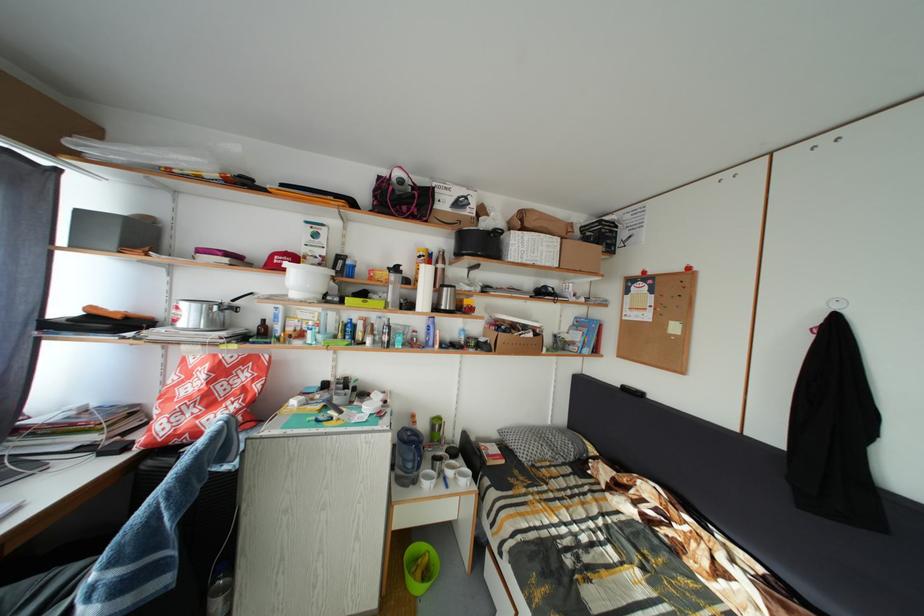
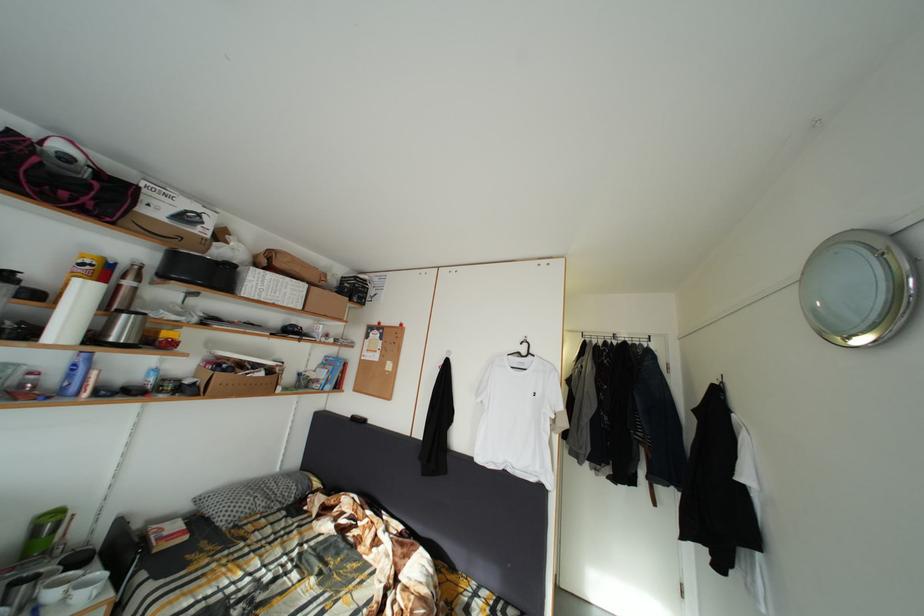
Where in the second image is the point corresponding to [429,262] from the first image?

(91, 270)